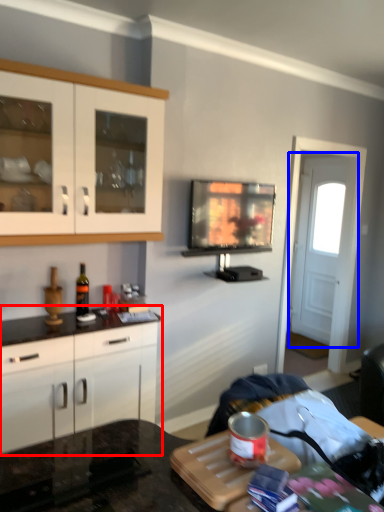
Question: Among these objects, which one is farthest to the camera, cabinetry (highlighted by a red box) or door (highlighted by a blue box)?

Choices:
 (A) cabinetry
 (B) door

Answer: (B)